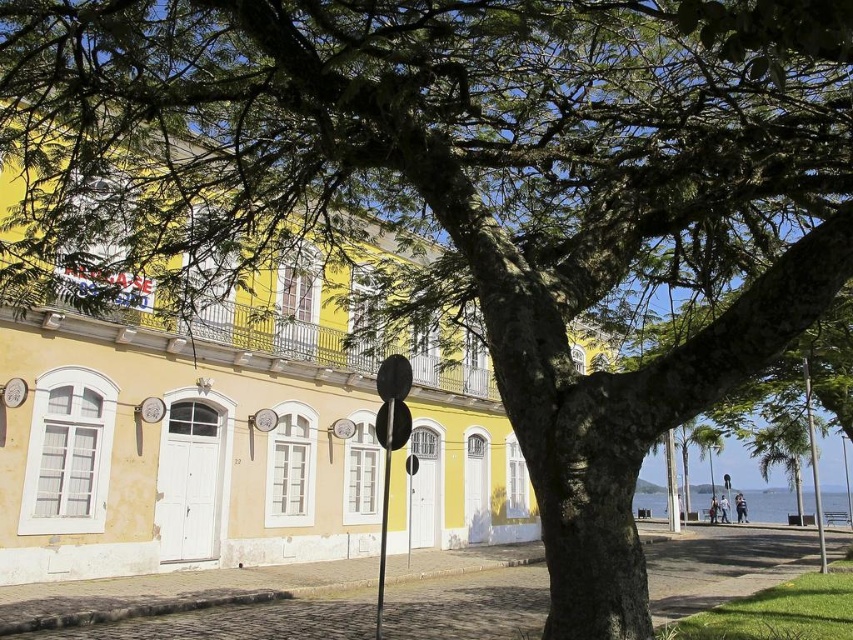
Between point (792, 484) and point (813, 477), which one is positioned behind?

Point (792, 484)

Can you confirm if green leafy tree at lower right is positioned above metallic pole at right?

Yes, green leafy tree at lower right is above metallic pole at right.

Locate an element on the screen. green leafy tree at lower right is located at coordinates (782, 451).

Which is in front, point (387, 477) or point (813, 483)?

Point (387, 477) is in front.

Does black glossy pole at center have a greater width compared to metallic pole at right?

In fact, black glossy pole at center might be narrower than metallic pole at right.

Identify the location of black glossy pole at center. (384, 512).

Find the location of a particular element. This screenshot has width=853, height=640. black glossy pole at center is located at coordinates (384, 512).

Is green leafy tree at lower right taller than black glossy pole at center?

Yes, green leafy tree at lower right is taller than black glossy pole at center.

Does green leafy tree at lower right have a greater width compared to black glossy pole at center?

Correct, the width of green leafy tree at lower right exceeds that of black glossy pole at center.

Who is more forward, (x=759, y=433) or (x=380, y=536)?

Point (x=380, y=536) is in front.

Locate an element on the screen. The image size is (853, 640). green leafy tree at lower right is located at coordinates (782, 451).